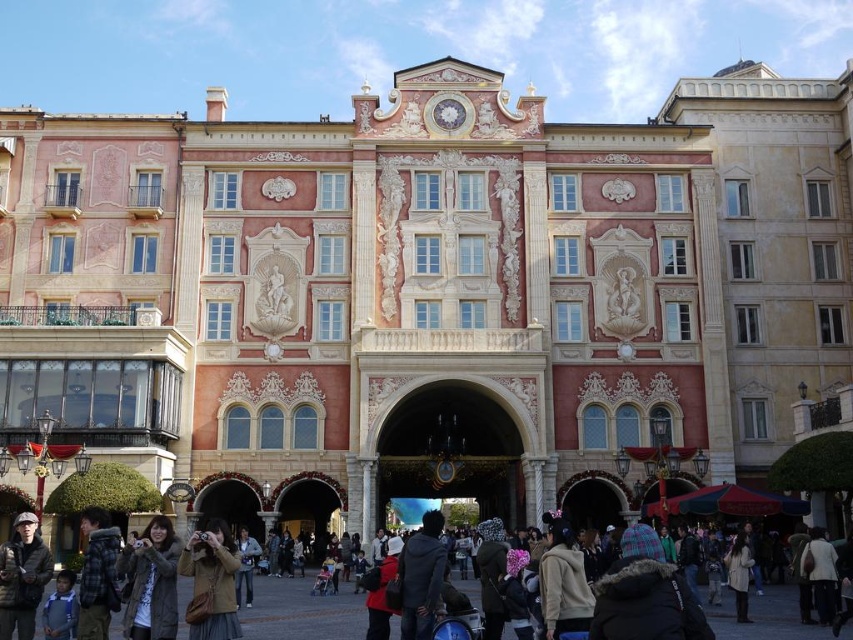
Question: Which point is closer to the camera taking this photo?

Choices:
 (A) (260, 612)
 (B) (231, 595)
 (C) (18, 595)
 (D) (564, 545)

Answer: (B)

Question: Does matte black jackets at lower center have a greater width compared to dark gray fabric jacket at lower left?

Choices:
 (A) no
 (B) yes

Answer: (B)

Question: Can you confirm if brown leather jacket at center is positioned to the left of beige fleece jacket at center?

Choices:
 (A) no
 (B) yes

Answer: (B)

Question: Which of these objects is positioned closest to the dark gray fabric jacket at lower left?

Choices:
 (A) brown leather jacket at center
 (B) brown textured coat at lower left
 (C) beige fleece jacket at center
 (D) beige wool coat at lower right

Answer: (B)

Question: Among these objects, which one is nearest to the camera?

Choices:
 (A) beige wool coat at lower right
 (B) brown leather jacket at center
 (C) brown textured coat at lower left

Answer: (B)

Question: Is brown textured coat at lower left to the right of beige fleece jacket at center from the viewer's perspective?

Choices:
 (A) no
 (B) yes

Answer: (A)